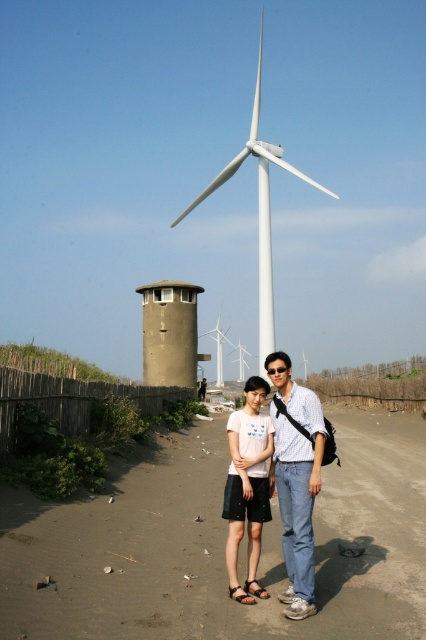
Does white matte wind turbine at center have a smaller size compared to white matte windmill at center?

No.

Image resolution: width=426 pixels, height=640 pixels. Describe the element at coordinates (259, 211) in the screenshot. I see `white matte wind turbine at center` at that location.

The image size is (426, 640). What do you see at coordinates (259, 211) in the screenshot? I see `white matte wind turbine at center` at bounding box center [259, 211].

Locate an element on the screen. Image resolution: width=426 pixels, height=640 pixels. white matte wind turbine at center is located at coordinates (259, 211).

Is denim jeans at center further to camera compared to white matte wind turbine at center?

No, denim jeans at center is closer to the viewer.

Locate an element on the screen. The width and height of the screenshot is (426, 640). denim jeans at center is located at coordinates (296, 481).

Image resolution: width=426 pixels, height=640 pixels. What do you see at coordinates (296, 481) in the screenshot?
I see `denim jeans at center` at bounding box center [296, 481].

Is point (311, 419) positioned behind point (250, 572)?

No, it is not.

Does point (305, 554) come in front of point (230, 506)?

Yes, it is.

Locate an element on the screen. The height and width of the screenshot is (640, 426). denim jeans at center is located at coordinates (296, 481).